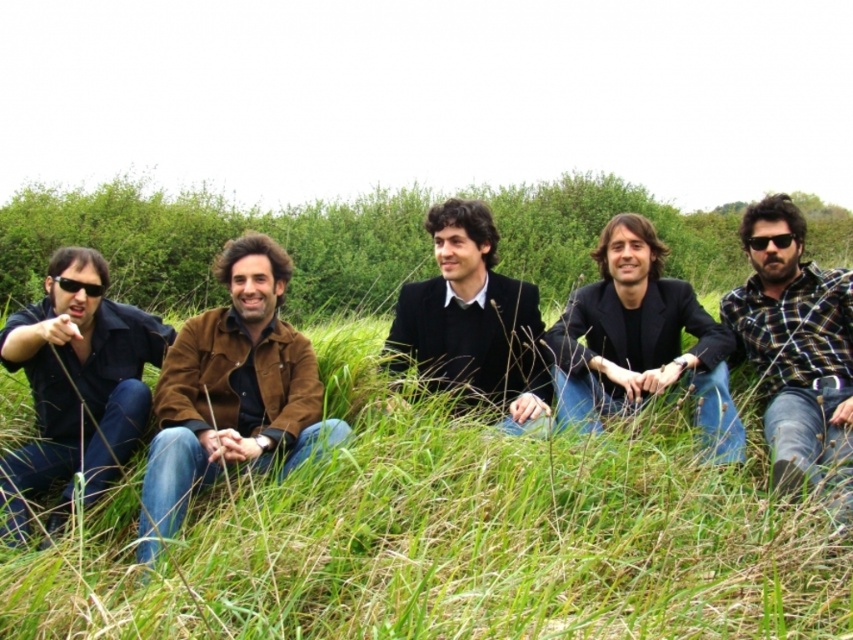
You are analyzing the spatial coordinates of the people in the image. The image has a coordinate system where the bottom left corner is the origin point. The first person from the left is wearing a dark blue shirt. Where is the 2D location of the matte black shirt at left?

The 2D location of the matte black shirt at left is at point (77, 380).

You are organizing a group photo and need to arrange the plaid flannel shirt at right and the black matte jacket at center based on their widths. Which should be placed on the left to ensure proper spacing?

The plaid flail shirt at right has a lesser width compared to the black matte jacket at center. Therefore, placing the plaid flannel shirt at right on the left side would allow for appropriate spacing between them.